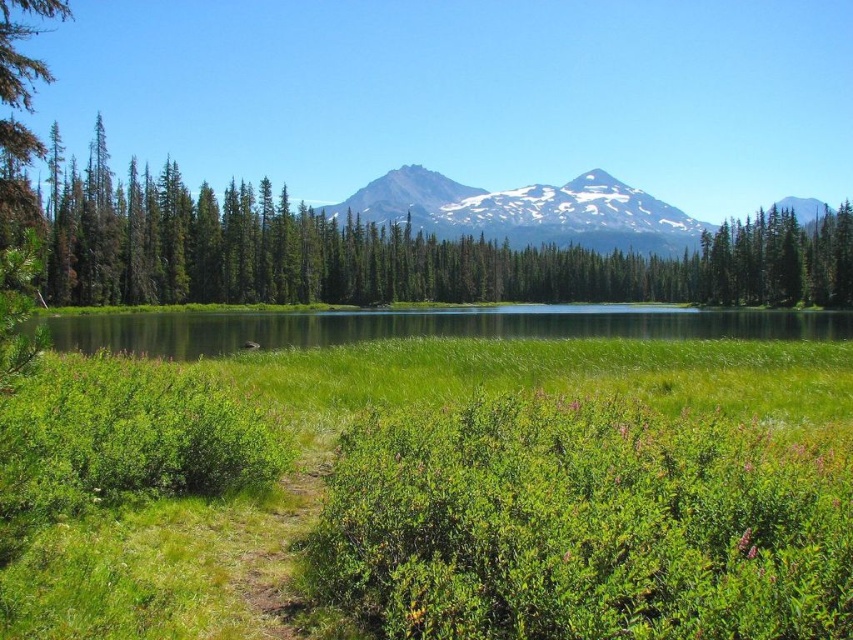
Question: Which object is the closest to the green leafy trees at center?

Choices:
 (A) green leafy grass at lower center
 (B) snowy rock mountain at center

Answer: (A)

Question: Does green leafy grass at lower center appear under green grassy water at center?

Choices:
 (A) no
 (B) yes

Answer: (B)

Question: Is green grassy water at center below snowy rock mountain at center?

Choices:
 (A) no
 (B) yes

Answer: (B)

Question: Which point is closer to the camera?

Choices:
 (A) (807, 220)
 (B) (126, 316)
 (C) (781, 262)

Answer: (B)

Question: Does green leafy trees at center have a lesser width compared to snowy rock mountain at center?

Choices:
 (A) yes
 (B) no

Answer: (A)

Question: Which point is closer to the camera?

Choices:
 (A) (788, 436)
 (B) (350, 276)
 (C) (236, 317)
 (D) (433, 204)

Answer: (A)